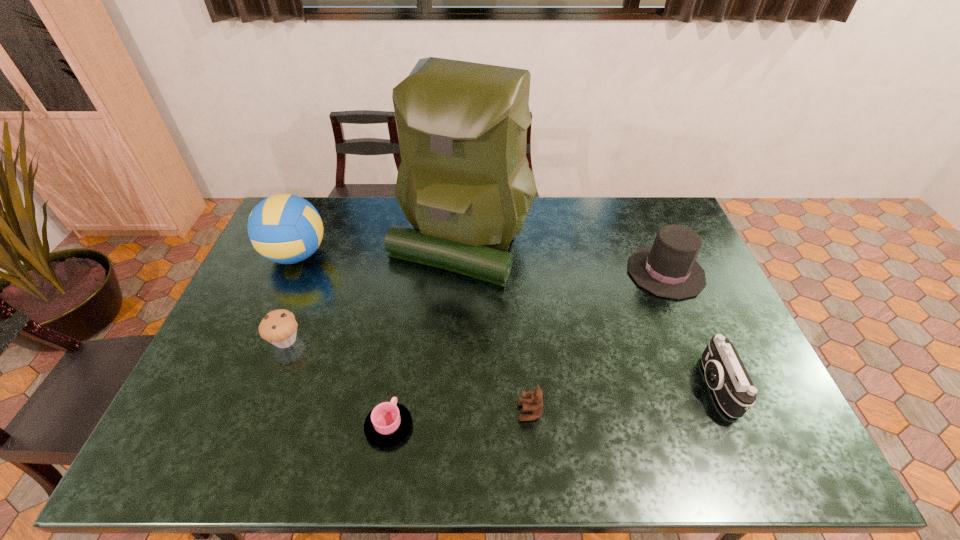
What are the coordinates of `vacant space at the far edge of the desktop` in the screenshot? It's located at (544, 233).

Where is `blank space at the near edge of the desktop`? blank space at the near edge of the desktop is located at coordinates (540, 450).

You are a GUI agent. You are given a task and a screenshot of the screen. Output one action in this format:
    pyautogui.click(x=<x>, y=<y>)
    Task: Click on the vacant space at the left edge of the desktop
    
    Given the screenshot: What is the action you would take?
    pyautogui.click(x=255, y=345)

Locate an element on the screen. vacant space at the right edge of the desktop is located at coordinates (764, 420).

Identify the location of free region at the near right corner. (764, 441).

Identify the location of blank region between the muffin and the second tallest object. (291, 298).

Where is `free spot between the shortest object and the muffin`? The image size is (960, 540). free spot between the shortest object and the muffin is located at coordinates (337, 383).

Locate an element on the screen. Image resolution: width=960 pixels, height=540 pixels. vacant space that is in between the camera and the muffin is located at coordinates (501, 363).

This screenshot has height=540, width=960. What are the coordinates of `free area in between the sixth shortest object and the muffin` in the screenshot? It's located at (291, 298).

Where is `vacant region between the tallest object and the second tallest object`? This screenshot has width=960, height=540. vacant region between the tallest object and the second tallest object is located at coordinates (379, 247).